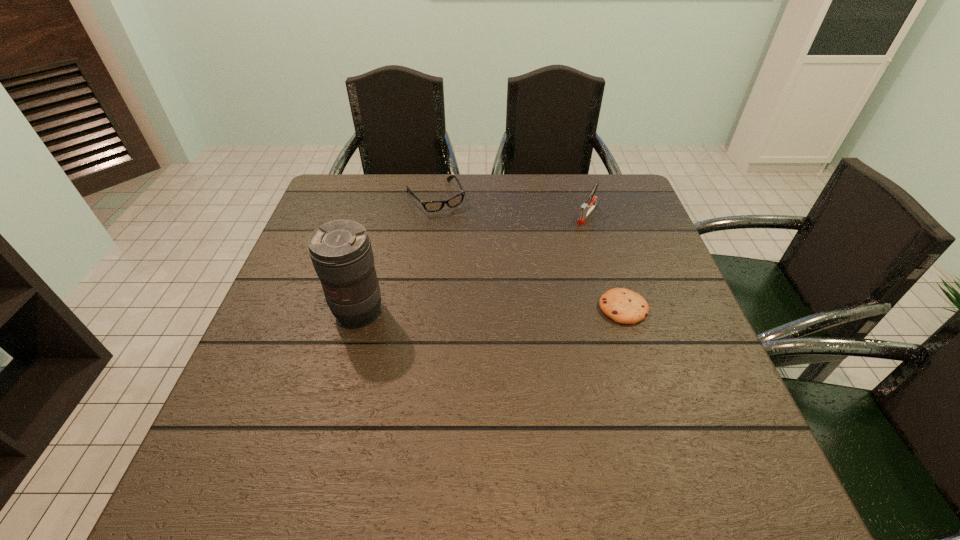
The image size is (960, 540). Find the location of `telephoto lens`. telephoto lens is located at coordinates (341, 252).

What are the coordinates of `the shortest object` in the screenshot? It's located at (624, 306).

The image size is (960, 540). Find the location of `the second shortest object`. the second shortest object is located at coordinates (430, 206).

Identify the location of the second tallest object. This screenshot has width=960, height=540. (586, 208).

Image resolution: width=960 pixels, height=540 pixels. In order to click on vacant region located 0.170m on the side of the tallest object where the control switches are located in this screenshot , I will do `click(335, 401)`.

Find the location of `free space located on the left of the cookie`. free space located on the left of the cookie is located at coordinates (444, 308).

Find the location of a particular element. This screenshot has width=960, height=540. free point located on the front-facing side of the third tallest object is located at coordinates (490, 279).

What are the coordinates of `vacant space positioned 0.060m on the front-facing side of the third tallest object` in the screenshot? It's located at (454, 226).

Locate an element on the screen. free region located on the front-facing side of the third tallest object is located at coordinates (476, 260).

You are a GUI agent. You are given a task and a screenshot of the screen. Output one action in this format:
    pyautogui.click(x=<x>, y=<y>)
    Task: Click on the vacant space located 0.130m on the handle side of the third shortest object
    The width and height of the screenshot is (960, 540).
    Given the screenshot: What is the action you would take?
    pyautogui.click(x=563, y=247)